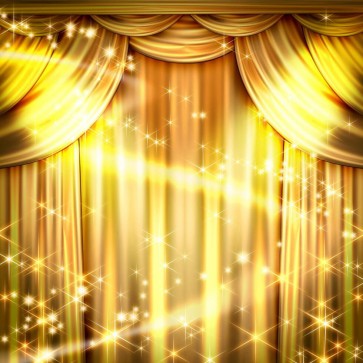
You are a GUI agent. You are given a task and a screenshot of the screen. Output one action in this format:
    pyautogui.click(x=<x>, y=<y>)
    Task: Click on the backdrop
    
    Given the screenshot: What is the action you would take?
    pyautogui.click(x=173, y=208)